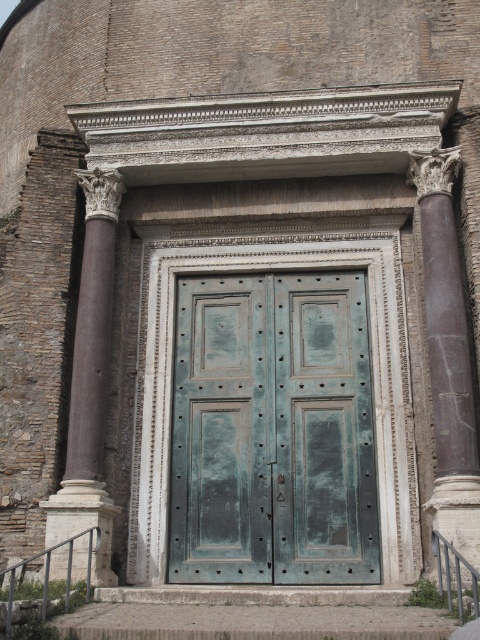
Can you confirm if brown marble column at right is positioned to the left of brown marble column at left?

Incorrect, brown marble column at right is not on the left side of brown marble column at left.

In the scene shown: Can you confirm if brown marble column at right is thinner than brown marble column at left?

Yes, brown marble column at right is thinner than brown marble column at left.

Between point (433, 209) and point (101, 323), which one is positioned in front?

Point (101, 323) is in front.

Locate an element on the screen. The width and height of the screenshot is (480, 640). brown marble column at right is located at coordinates (447, 353).